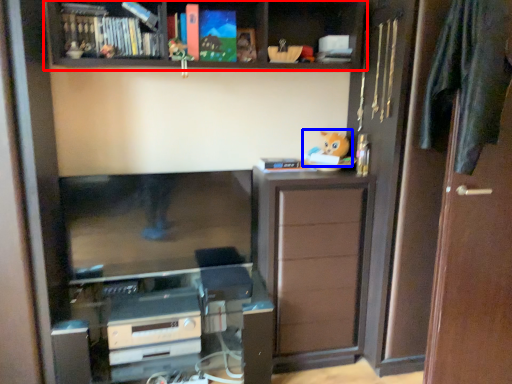
Question: Which point is closer to the camera, shelf (highlighted by a red box) or toy (highlighted by a blue box)?

Choices:
 (A) shelf
 (B) toy

Answer: (A)